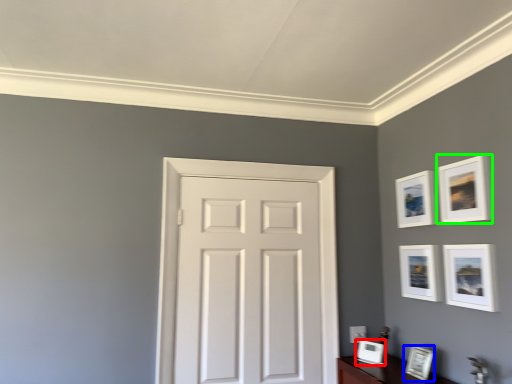
Question: Based on their relative distances, which object is nearer to picture frame (highlighted by a red box)? Choose from picture frame (highlighted by a blue box) and picture frame (highlighted by a green box).

Choices:
 (A) picture frame
 (B) picture frame

Answer: (A)